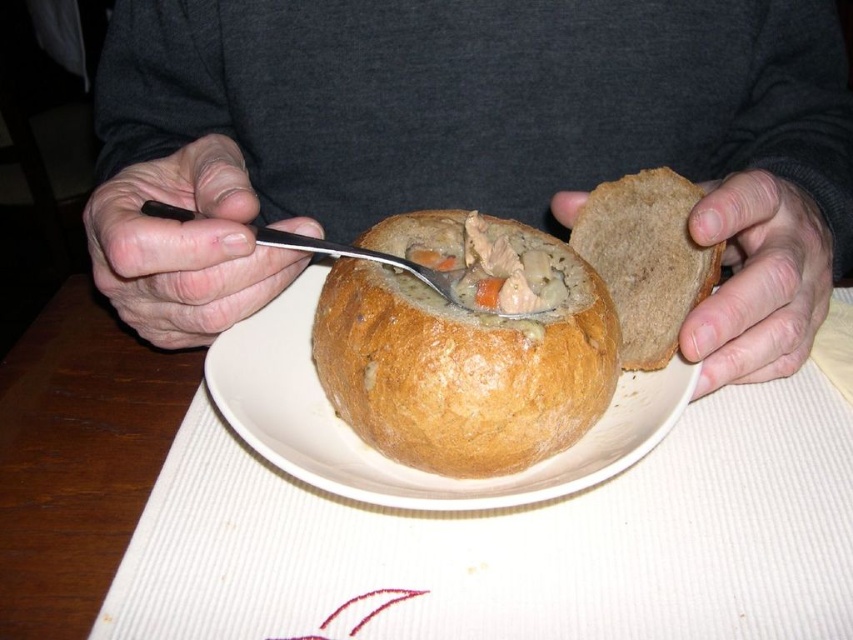
You are a photographer trying to capture the golden brown bread bowl at center in the image. According to the coordinates provided, where exactly should you focus your camera lens to ensure the bread bowl is centered in your shot?

To center the golden brown bread bowl at center in your shot, focus your camera lens at the coordinates point (471, 141) as the bread bowl is located there.

You are a chef preparing a meal and need to place the golden brown bread bowl at center onto the wooden table at center. Based on the scene description, will the bread bowl fit on the table?

The golden brown bread bowl at center is larger in size than wooden table at center, so it will not fit on the table.